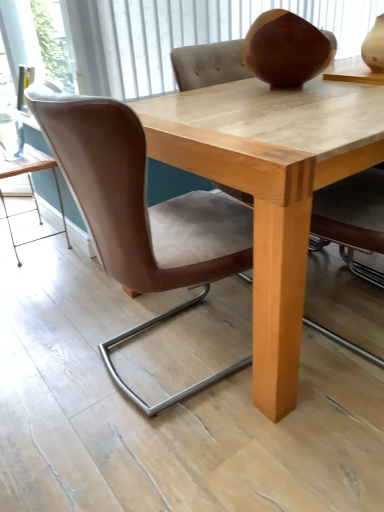
This screenshot has height=512, width=384. Find the location of `blank area to the left of brown leather chair at center`. blank area to the left of brown leather chair at center is located at coordinates (58, 353).